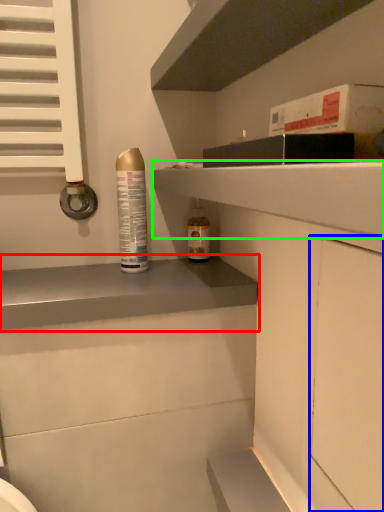
Question: Estimate the real-world distances between objects in this image. Which object is farther from shelf (highlighted by a red box), screen door (highlighted by a blue box) or shelf (highlighted by a green box)?

Choices:
 (A) screen door
 (B) shelf

Answer: (A)